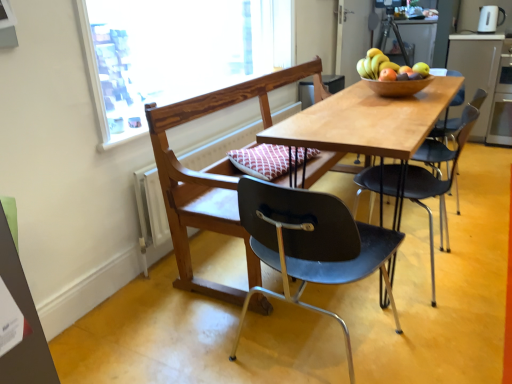
This screenshot has width=512, height=384. Identify the location of vacant space to the right of matte black chair at center, which is the 3th chair from front to back. click(475, 255).